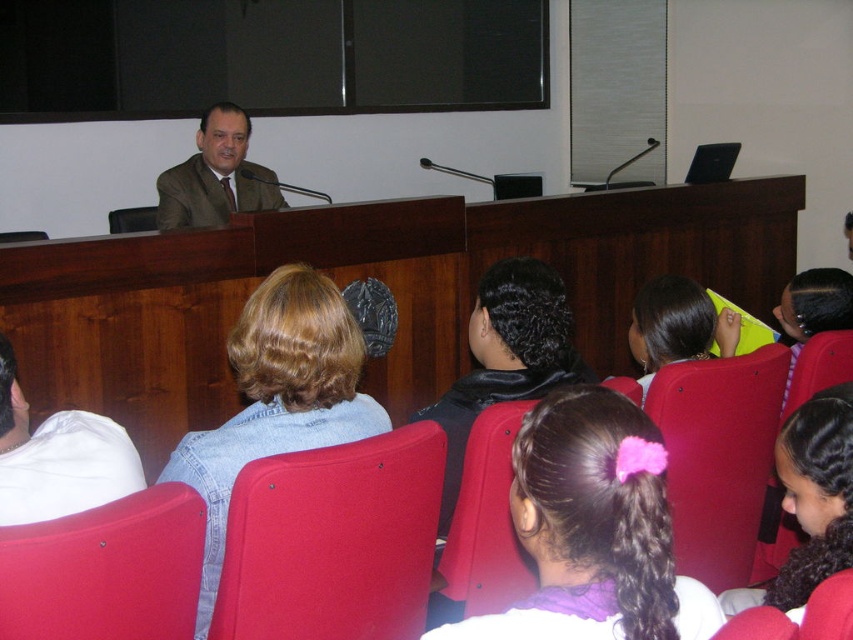
Between black plastic chair at center and matte red chair at center, which one appears on the left side from the viewer's perspective?

matte red chair at center is more to the left.

Is black plastic chair at center positioned before matte red chair at center?

No, black plastic chair at center is further to the viewer.

Is point (146, 227) behind point (22, 234)?

Yes.

Where is `black plastic chair at center`? The height and width of the screenshot is (640, 853). black plastic chair at center is located at coordinates (132, 220).

Does matte plastic chair at lower left appear under matte red chair at center?

Indeed, matte plastic chair at lower left is positioned under matte red chair at center.

The width and height of the screenshot is (853, 640). I want to click on matte plastic chair at lower left, so click(106, 570).

Is point (190, 579) closer to camera compared to point (15, 234)?

That is True.

Where is `matte plastic chair at lower left`? This screenshot has width=853, height=640. matte plastic chair at lower left is located at coordinates (106, 570).

Locate an element on the screen. matte red chair at lower center is located at coordinates (718, 456).

Can you confirm if matte red chair at lower center is positioned to the left of pink fabric hairband at upper center?

Incorrect, matte red chair at lower center is not on the left side of pink fabric hairband at upper center.

Who is more forward, (689, 456) or (674, 285)?

Point (689, 456)

At what (x,y) coordinates should I click in order to perform the action: click on matte red chair at lower center. Please return your answer as a coordinate pair (x, y). This screenshot has width=853, height=640. Looking at the image, I should click on [x=718, y=456].